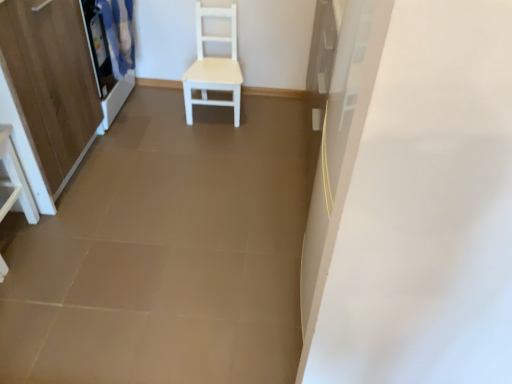
Question: Should I look upward or downward to see matte white curtain at upper left?

Choices:
 (A) down
 (B) up

Answer: (B)

Question: Can you confirm if white glossy vanity at lower left is thinner than wooden cabinet at left?

Choices:
 (A) yes
 (B) no

Answer: (A)

Question: Can we say white glossy vanity at lower left lies outside wooden cabinet at left?

Choices:
 (A) no
 (B) yes

Answer: (A)

Question: Is white glossy vanity at lower left to the right of wooden cabinet at left from the viewer's perspective?

Choices:
 (A) no
 (B) yes

Answer: (B)

Question: Considering the relative sizes of white glossy vanity at lower left and wooden cabinet at left in the image provided, is white glossy vanity at lower left wider than wooden cabinet at left?

Choices:
 (A) yes
 (B) no

Answer: (B)

Question: Is white glossy vanity at lower left oriented away from wooden cabinet at left?

Choices:
 (A) no
 (B) yes

Answer: (B)

Question: Is white glossy vanity at lower left shorter than wooden cabinet at left?

Choices:
 (A) yes
 (B) no

Answer: (A)

Question: Is white matte chair at center smaller than wooden cabinet at left?

Choices:
 (A) yes
 (B) no

Answer: (A)

Question: Considering the relative sizes of white matte chair at center and wooden cabinet at left in the image provided, is white matte chair at center taller than wooden cabinet at left?

Choices:
 (A) yes
 (B) no

Answer: (B)

Question: Can wooden cabinet at left be found inside white matte chair at center?

Choices:
 (A) no
 (B) yes

Answer: (A)

Question: Considering the relative positions of white matte chair at center and wooden cabinet at left in the image provided, is white matte chair at center to the right of wooden cabinet at left from the viewer's perspective?

Choices:
 (A) no
 (B) yes

Answer: (B)

Question: Is white matte chair at center behind wooden cabinet at left?

Choices:
 (A) yes
 (B) no

Answer: (A)

Question: Is white matte chair at center in contact with wooden cabinet at left?

Choices:
 (A) no
 (B) yes

Answer: (A)

Question: Can we say white matte chair at center lies outside white glossy vanity at lower left?

Choices:
 (A) no
 (B) yes

Answer: (B)